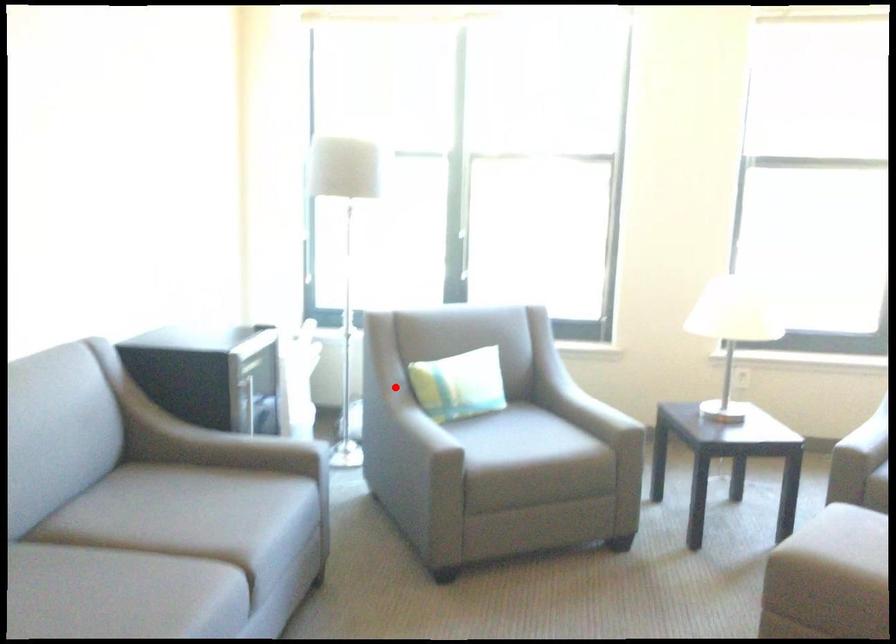
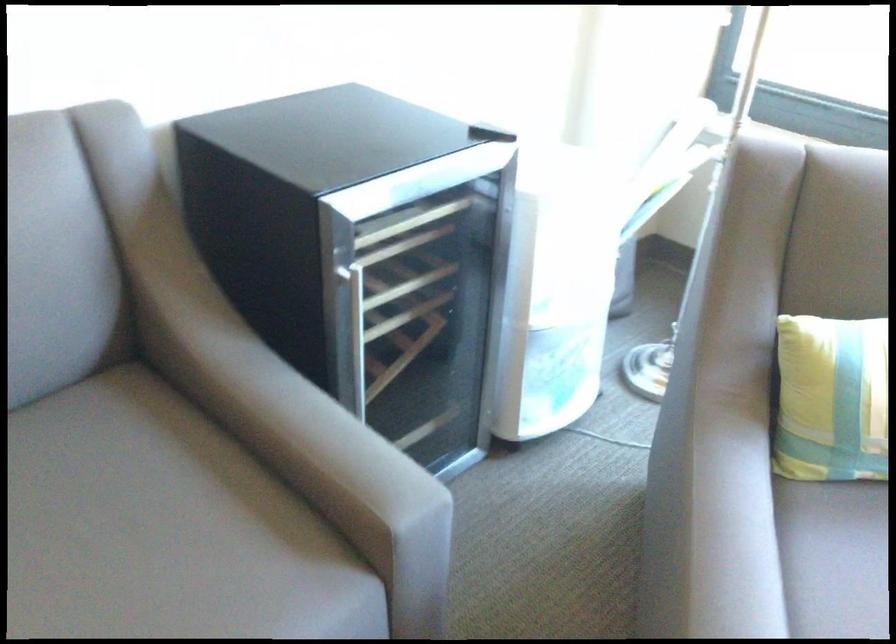
Question: I am providing you with two images of the same scene from different viewpoints. Given a red point in image1, look at the same physical point in image2. Is it:

Choices:
 (A) Closer to the viewpoint
 (B) Farther from the viewpoint

Answer: (A)